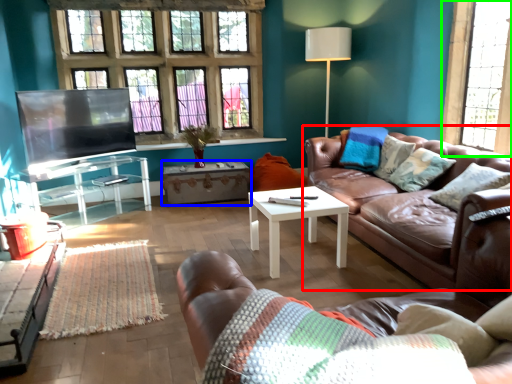
Question: Considering the real-world distances, which object is farthest from studio couch (highlighted by a red box)? table (highlighted by a blue box) or window (highlighted by a green box)?

Choices:
 (A) table
 (B) window

Answer: (A)